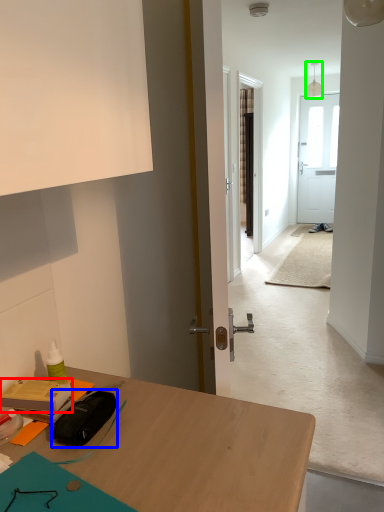
Question: Estimate the real-world distances between objects in this image. Which object is closer to stationery (highlighted by a red box), stationery (highlighted by a blue box) or lamp (highlighted by a green box)?

Choices:
 (A) stationery
 (B) lamp

Answer: (A)